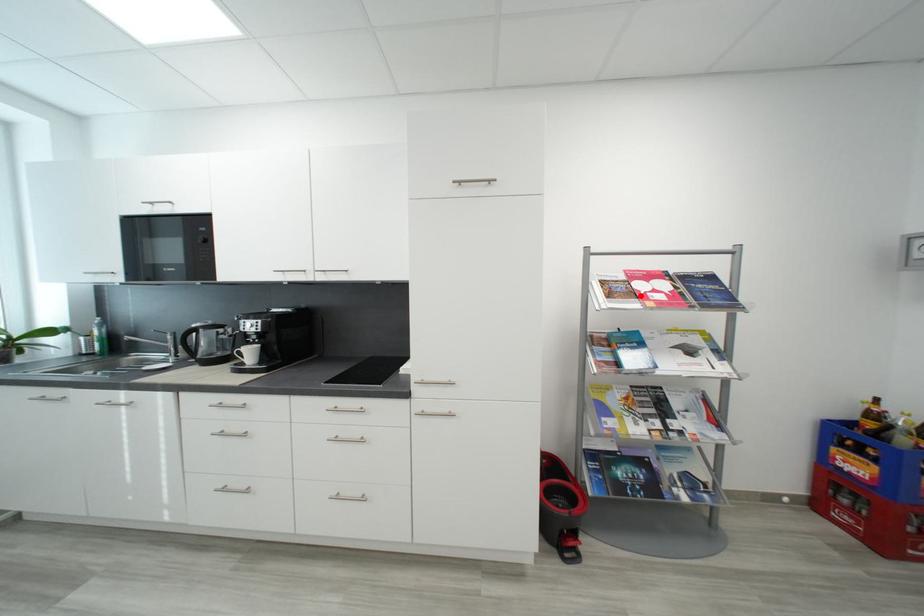
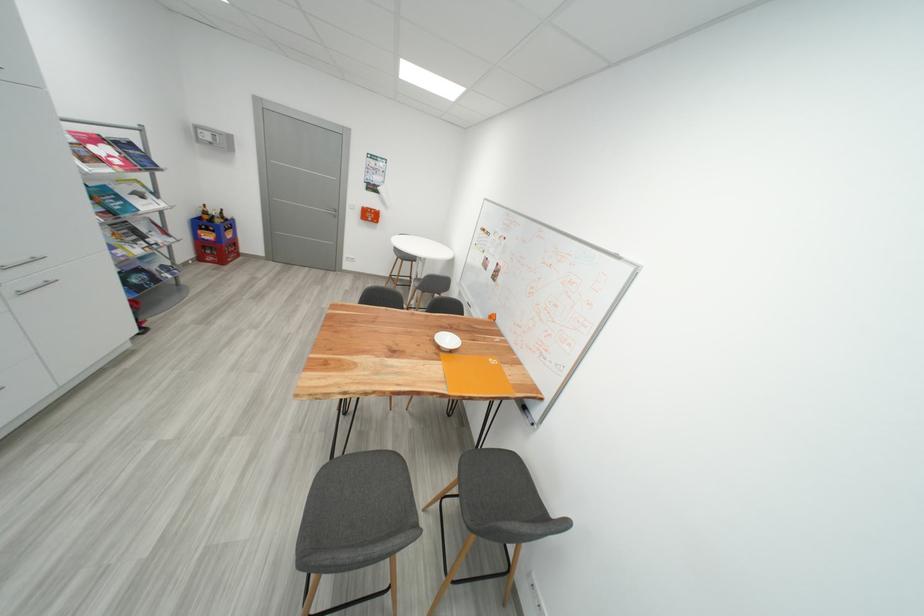
Find the pixel in the second image that matches the highlighted location in the first image.

(104, 161)